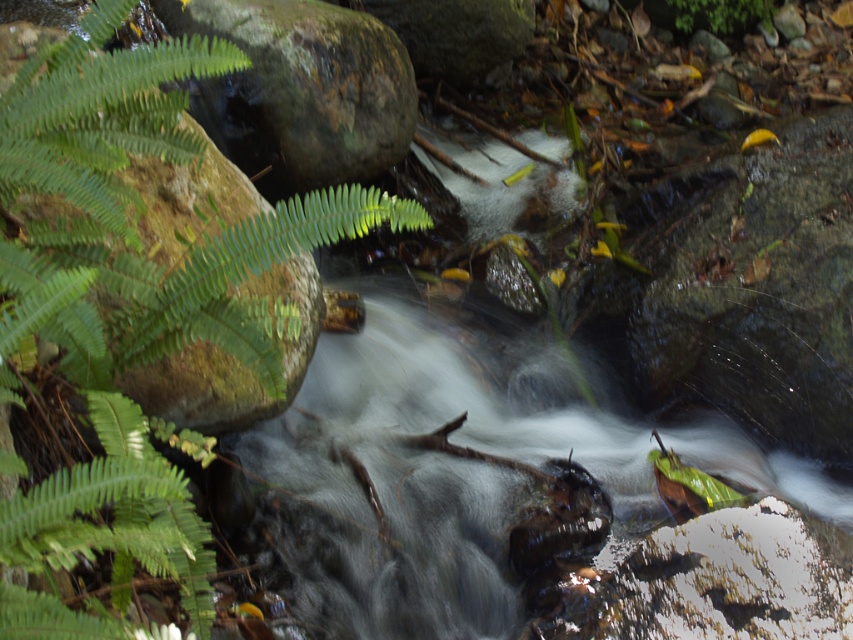
Can you confirm if green mossy rock at center-left is positioned above green leafy plant at upper right?

Incorrect, green mossy rock at center-left is not positioned above green leafy plant at upper right.

Does point (222, 129) come closer to viewer compared to point (697, 24)?

Yes, it is in front of point (697, 24).

Between point (407, 148) and point (698, 24), which one is positioned in front?

Point (407, 148) is more forward.

I want to click on green mossy rock at center-left, so click(x=300, y=90).

Is green leafy fern at upper left closer to camera compared to green mossy rock at center-left?

Yes, green leafy fern at upper left is closer to the viewer.

Consider the image. Is green leafy fern at upper left below green mossy rock at center-left?

Yes.

The image size is (853, 640). What are the coordinates of `green leafy fern at upper left` in the screenshot? It's located at (132, 282).

Where is `green leafy fern at upper left`? green leafy fern at upper left is located at coordinates (132, 282).

Does point (225, 317) come farther from viewer compared to point (689, 12)?

No.

Based on the photo, is the position of green leafy fern at upper left more distant than that of green leafy plant at upper right?

No, green leafy fern at upper left is closer to the viewer.

Is point (59, 288) farther from camera compared to point (756, 13)?

That is False.

At what (x,y) coordinates should I click in order to perform the action: click on green leafy fern at upper left. Please return your answer as a coordinate pair (x, y). The width and height of the screenshot is (853, 640). Looking at the image, I should click on (132, 282).